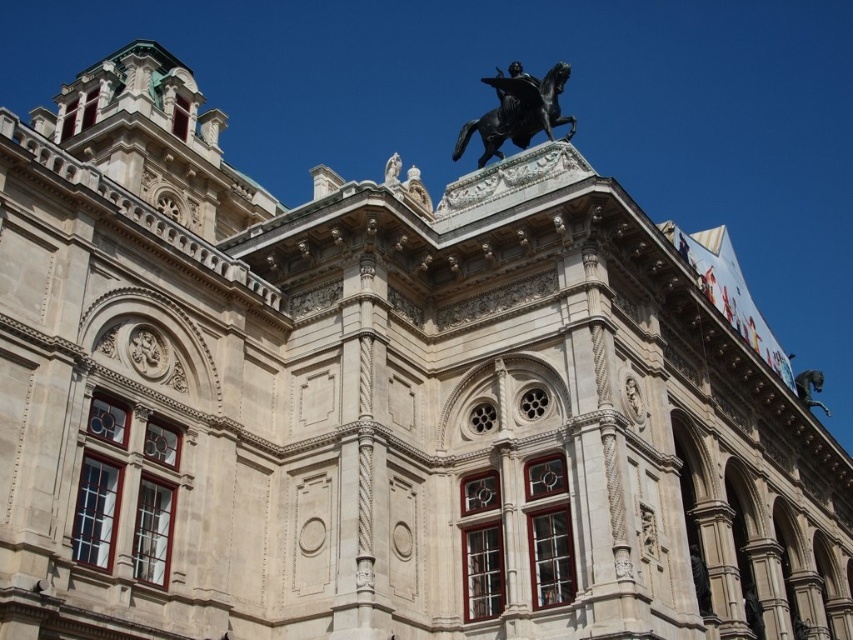
You are standing in front of the grand building and want to locate the black polished bronze horse at upper center. According to the coordinates provided, where exactly should you look?

The black polished bronze horse at upper center is located at point 0.175 on the x axis and 0.608 on the y axis.

You are an architect analyzing the building facade. You notice a specific point at coordinates (518, 112). What object is located at this position?

The point at coordinates (518, 112) corresponds to the black polished bronze horse at upper center.